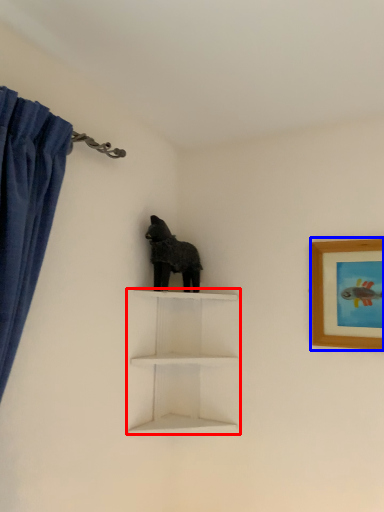
Question: Which object appears closest to the camera in this image, shelf (highlighted by a red box) or picture frame (highlighted by a blue box)?

Choices:
 (A) shelf
 (B) picture frame

Answer: (B)